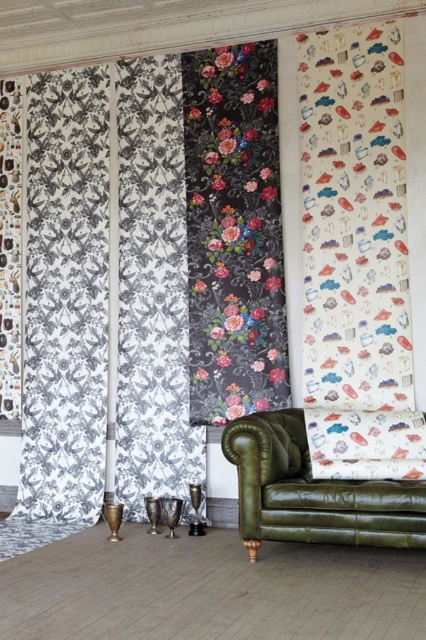
Question: Is black and white patterned fabric at left thinner than white paper with colorful illustrations at right?

Choices:
 (A) yes
 (B) no

Answer: (B)

Question: Where is floral fabric at center located in relation to olive green leather armchair at lower right in the image?

Choices:
 (A) left
 (B) right

Answer: (A)

Question: Observing the image, what is the correct spatial positioning of black and white patterned fabric at left in reference to floral fabric at center?

Choices:
 (A) above
 (B) below

Answer: (B)

Question: Which point is closer to the camera taking this photo?

Choices:
 (A) (229, 273)
 (B) (347, 324)
 (C) (376, 484)

Answer: (C)

Question: Which object is farther from the camera taking this photo?

Choices:
 (A) white paper with colorful illustrations at right
 (B) olive green leather armchair at lower right
 (C) black and white patterned fabric at left

Answer: (C)

Question: Which point appears closest to the camera in this image?

Choices:
 (A) (382, 378)
 (B) (265, 483)
 (C) (158, 371)
 (D) (264, 84)

Answer: (B)